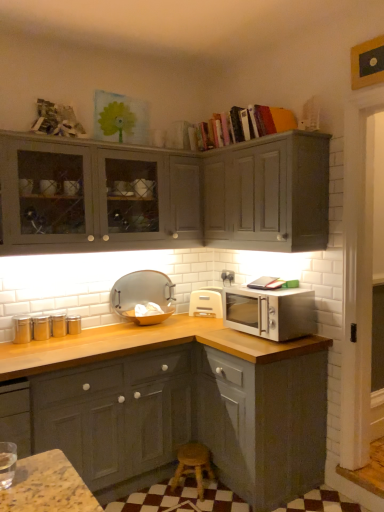
Question: Should I look upward or downward to see matte silver tray at center, marked as the second appliance in a right-to-left arrangement?

Choices:
 (A) up
 (B) down

Answer: (B)

Question: Considering the relative sizes of satin silver microwave at right and matte silver tray at center, marked as the second appliance in a right-to-left arrangement, in the image provided, is satin silver microwave at right bigger than matte silver tray at center, marked as the second appliance in a right-to-left arrangement,?

Choices:
 (A) yes
 (B) no

Answer: (A)

Question: Can you confirm if satin silver microwave at right is positioned to the right of matte silver tray at center, marked as the second appliance in a right-to-left arrangement?

Choices:
 (A) no
 (B) yes

Answer: (B)

Question: Would you say satin silver microwave at right is a long distance from matte silver tray at center, the 1th appliance when ordered from left to right?

Choices:
 (A) yes
 (B) no

Answer: (B)

Question: Is satin silver microwave at right looking in the opposite direction of matte silver tray at center, marked as the second appliance in a right-to-left arrangement?

Choices:
 (A) yes
 (B) no

Answer: (B)

Question: From a real-world perspective, is satin silver microwave at right below matte silver tray at center, marked as the second appliance in a right-to-left arrangement?

Choices:
 (A) no
 (B) yes

Answer: (B)

Question: Is satin silver microwave at right thinner than matte silver tray at center, the 1th appliance when ordered from left to right?

Choices:
 (A) no
 (B) yes

Answer: (A)

Question: From a real-world perspective, is satin silver microwave at right positioned over hardcover books at upper center based on gravity?

Choices:
 (A) yes
 (B) no

Answer: (B)

Question: Does satin silver microwave at right appear on the left side of hardcover books at upper center?

Choices:
 (A) yes
 (B) no

Answer: (B)

Question: Does satin silver microwave at right have a greater height compared to hardcover books at upper center?

Choices:
 (A) yes
 (B) no

Answer: (B)

Question: Can you confirm if satin silver microwave at right is smaller than hardcover books at upper center?

Choices:
 (A) yes
 (B) no

Answer: (A)

Question: Does satin silver microwave at right have a larger size compared to hardcover books at upper center?

Choices:
 (A) yes
 (B) no

Answer: (B)

Question: Is satin silver microwave at right facing towards hardcover books at upper center?

Choices:
 (A) no
 (B) yes

Answer: (A)

Question: From the image's perspective, is wooden at lower center beneath satin silver microwave at right?

Choices:
 (A) yes
 (B) no

Answer: (A)